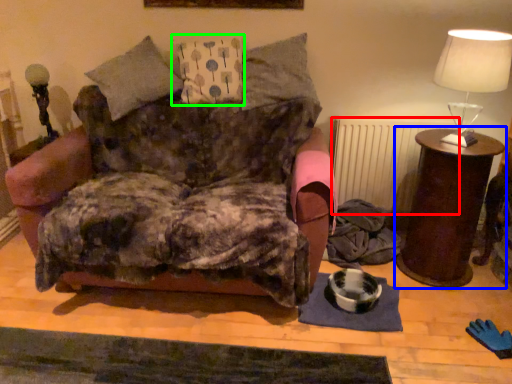
Question: Based on their relative distances, which object is farther from radiator (highlighted by a red box)? Choose from nightstand (highlighted by a blue box) and pillow (highlighted by a green box).

Choices:
 (A) nightstand
 (B) pillow

Answer: (B)